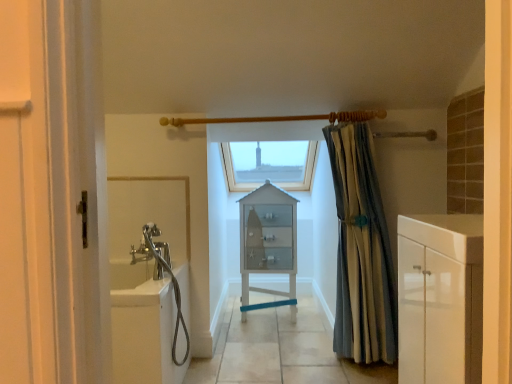
Question: From a real-world perspective, is transparent glass window at center positioned above or below white glossy cabinet at right?

Choices:
 (A) above
 (B) below

Answer: (A)

Question: Is transparent glass window at center situated inside white glossy cabinet at right or outside?

Choices:
 (A) inside
 (B) outside

Answer: (B)

Question: Which object is the farthest from the white glass cabinet at center?

Choices:
 (A) white glossy cabinet at right
 (B) transparent glass window at center
 (C) white glossy bathtub at left
 (D) white tile floor at center
 (E) striped fabric curtain at right

Answer: (A)

Question: Estimate the real-world distances between objects in this image. Which object is closer to the white glass cabinet at center?

Choices:
 (A) white tile floor at center
 (B) striped fabric curtain at right
 (C) white glossy bathtub at left
 (D) white glossy cabinet at right
 (E) white glossy cabinet at right

Answer: (A)